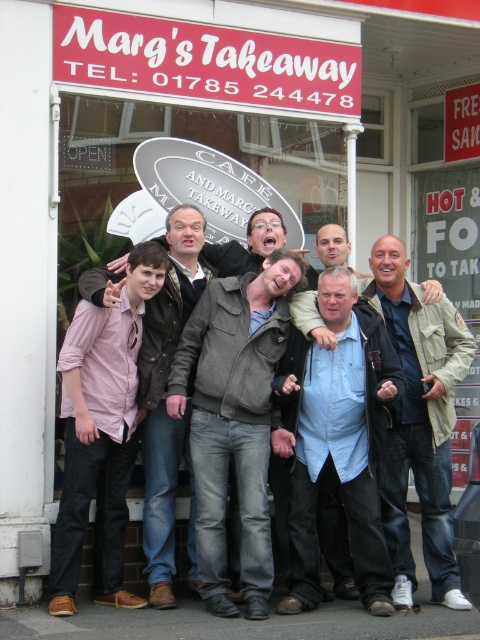
The width and height of the screenshot is (480, 640). In order to click on blue denim shirt at center in this screenshot , I will do `click(337, 442)`.

Which is in front, point (328, 280) or point (74, 387)?

Point (74, 387) is more forward.

The image size is (480, 640). I want to click on blue denim shirt at center, so click(x=337, y=442).

What are the coordinates of `blue denim shirt at center` in the screenshot? It's located at (337, 442).

Can you confirm if pink fabric shirt at left is positioned to the left of khaki cotton jacket at center?

Correct, you'll find pink fabric shirt at left to the left of khaki cotton jacket at center.

Is point (160, 284) in front of point (435, 522)?

That is True.

The width and height of the screenshot is (480, 640). What are the coordinates of `pink fabric shirt at left` in the screenshot? It's located at (100, 433).

This screenshot has height=640, width=480. I want to click on blue denim shirt at center, so click(337, 442).

Identify the location of blue denim shirt at center. (337, 442).